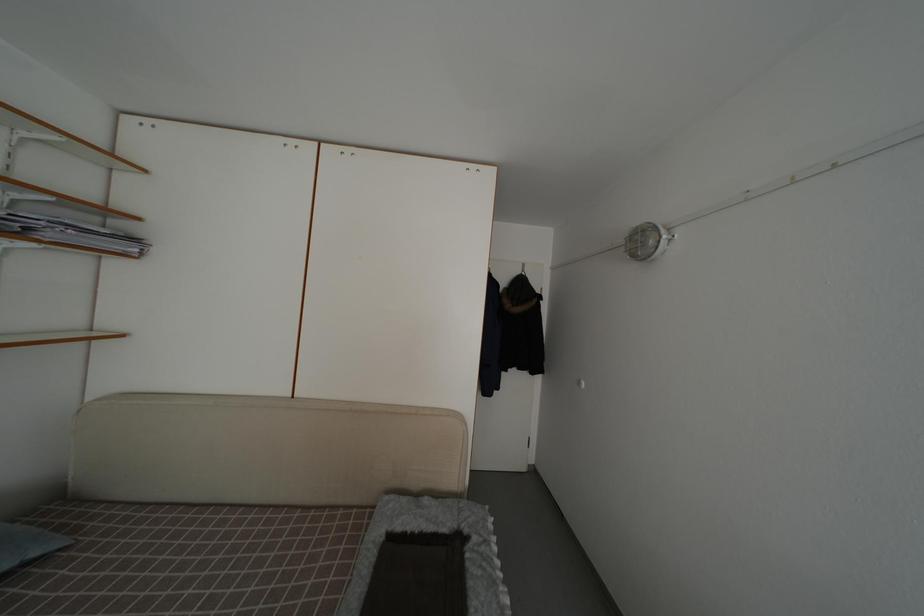
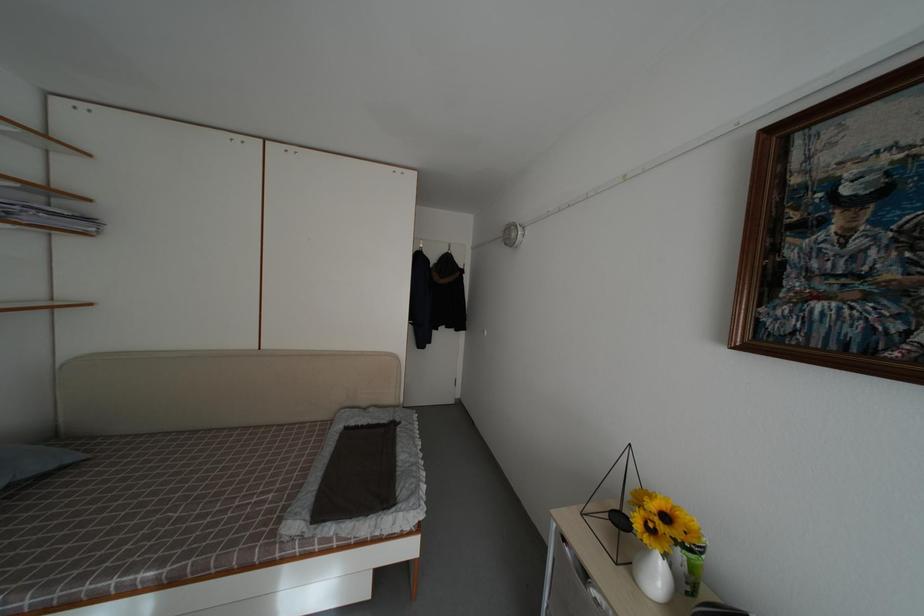
Where in the second image is the point corresponding to point 140,246 from the first image?

(94, 225)